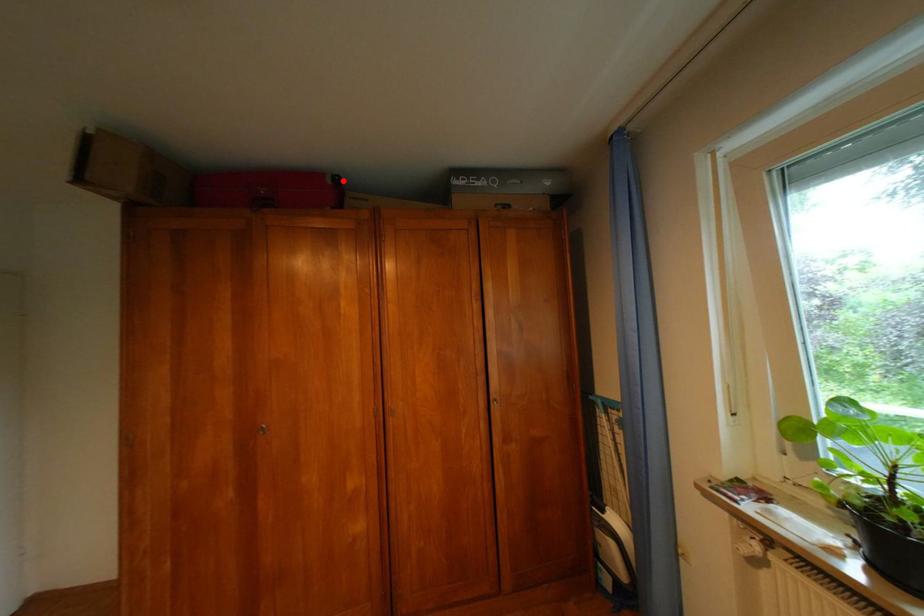
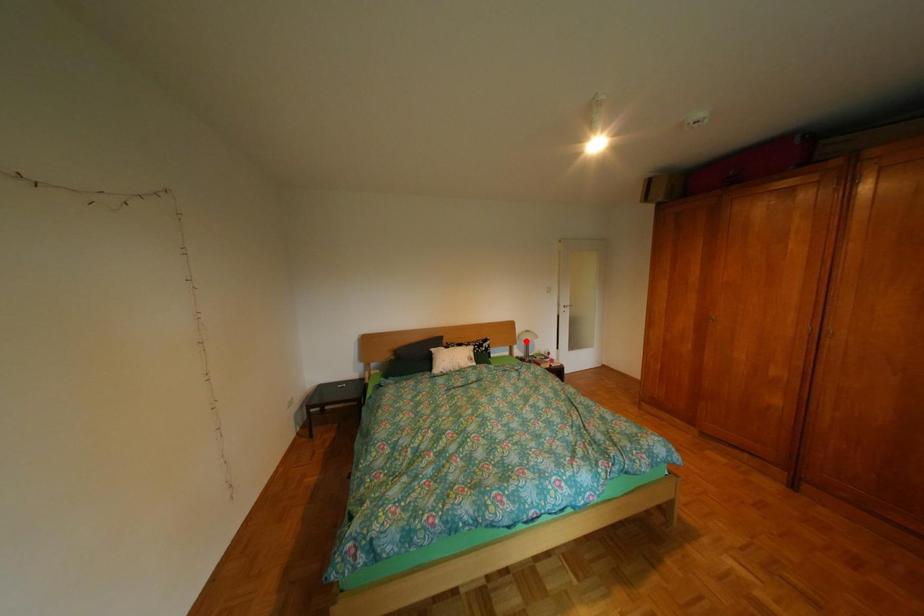
I am providing you with two images of the same scene from different viewpoints. A red point is marked on the first image and another point is marked on the second image. Are the points marked in image1 and image2 representing the same 3D position?

No